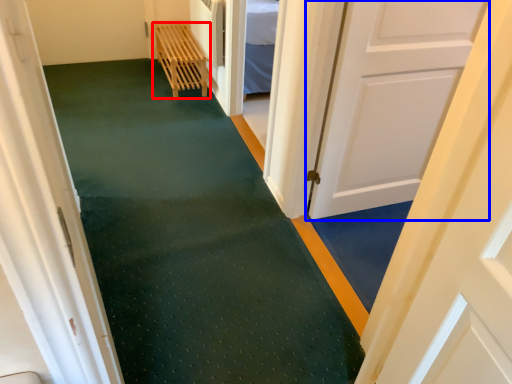
Question: Which point is further to the camera, furniture (highlighted by a red box) or door (highlighted by a blue box)?

Choices:
 (A) furniture
 (B) door

Answer: (A)